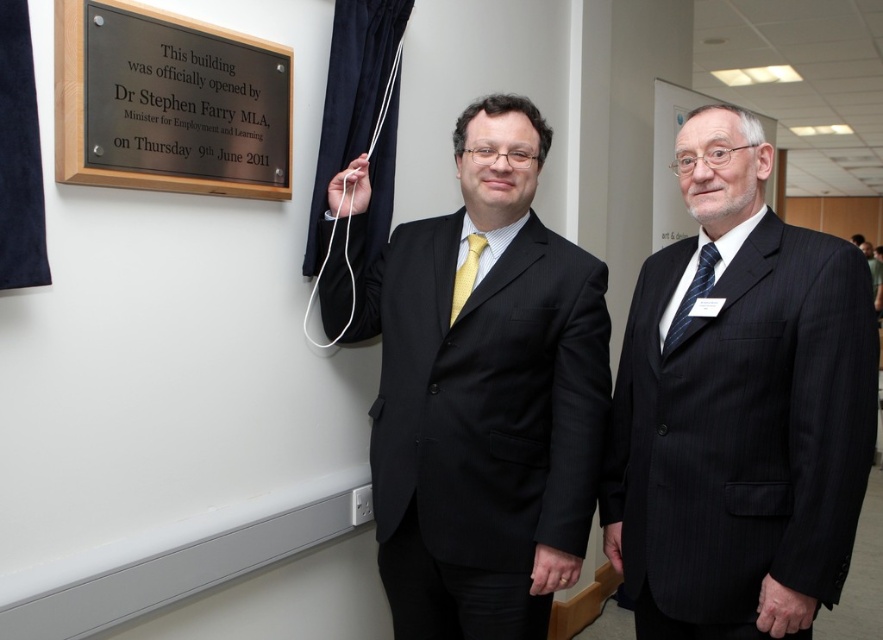
You are attending a formal event and notice the black polished plaque at upper left and the yellow silk tie at center. Which object is positioned higher in the image?

The black polished plaque at upper left is located above the yellow silk tie at center, so it is positioned higher in the image.

You are an event photographer at the unveiling ceremony. You need to position yourself so that the black pinstripe suit at center and the black polished plaque at upper left are both fully visible in your shot. Given their sizes, which one requires you to stand further back to ensure it fits entirely in the frame?

The black pinstripe suit at center is wider than the black polished plaque at upper left, so you need to stand further back to ensure the black pinstripe suit at center fits entirely in the frame.

Based on the scene described, which object is taller between the black pinstripe suit at center and the black polished plaque at upper left?

The black pinstripe suit at center is taller than the black polished plaque at upper left according to the description.